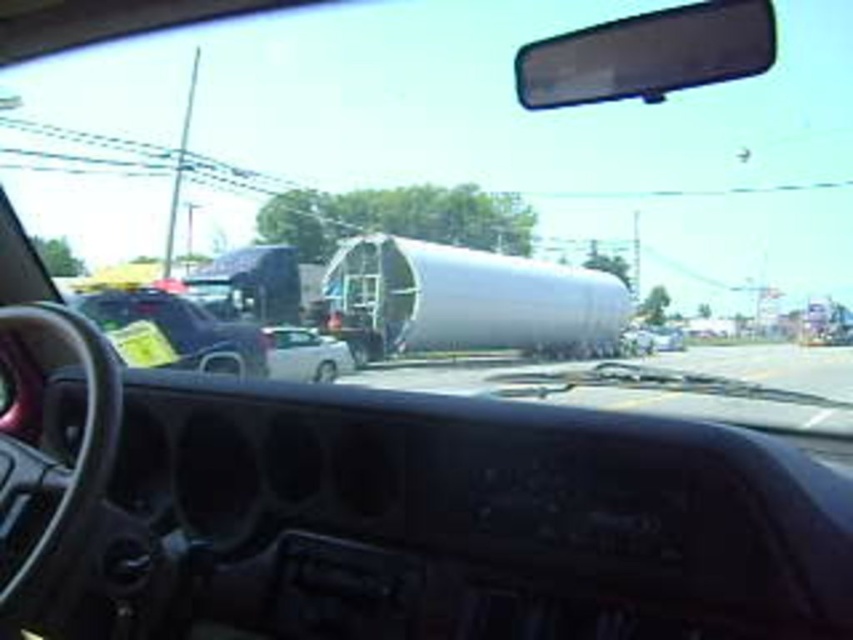
You are driving a car with a 120 feet long trailer attached. You need to navigate through the space between the two points marked as point (703, 12). Can your trailer fit through the space? Please answer based on the distance between the two points.

The distance between the two points marked as point (703, 12) is 110.37 feet. Since your trailer is 120 feet long, it cannot fit through the space as the required length is longer than the available distance.

You are a delivery driver who needs to navigate around the transparent plastic view mirror at upper center and the white glossy car at center. Given that your delivery truck is 12 meters long, can you safely maneuver between them without hitting either object?

The transparent plastic view mirror at upper center and the white glossy car at center are 223.28 meters apart from each other. Since your delivery truck is only 12 meters long, there is ample space to safely maneuver between them without any collision risks.

You are driving a car and want to know how far the point at coordinates (558, 38) is from your current position. Can you determine the distance?

The point at coordinates (558, 38) is 36.95 meters away from your current position.